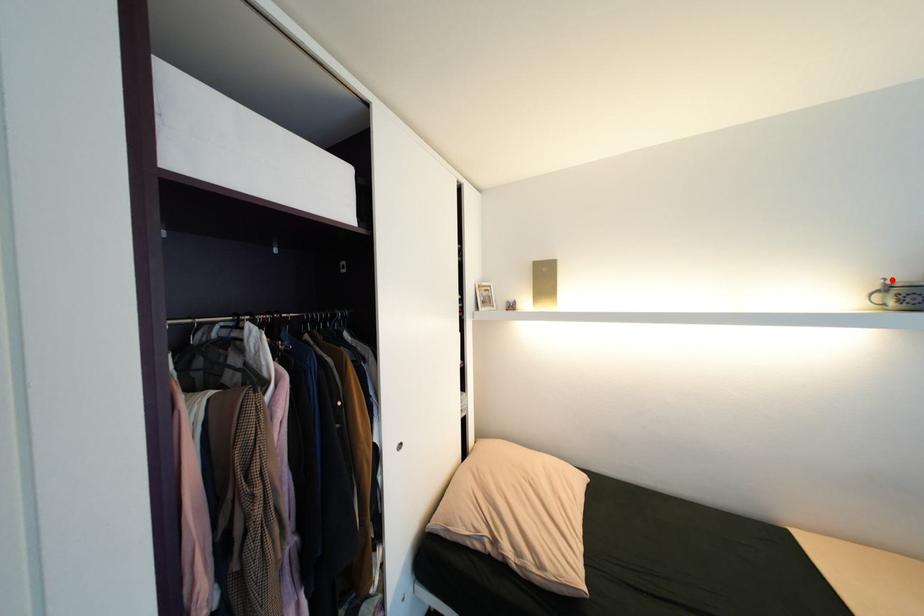
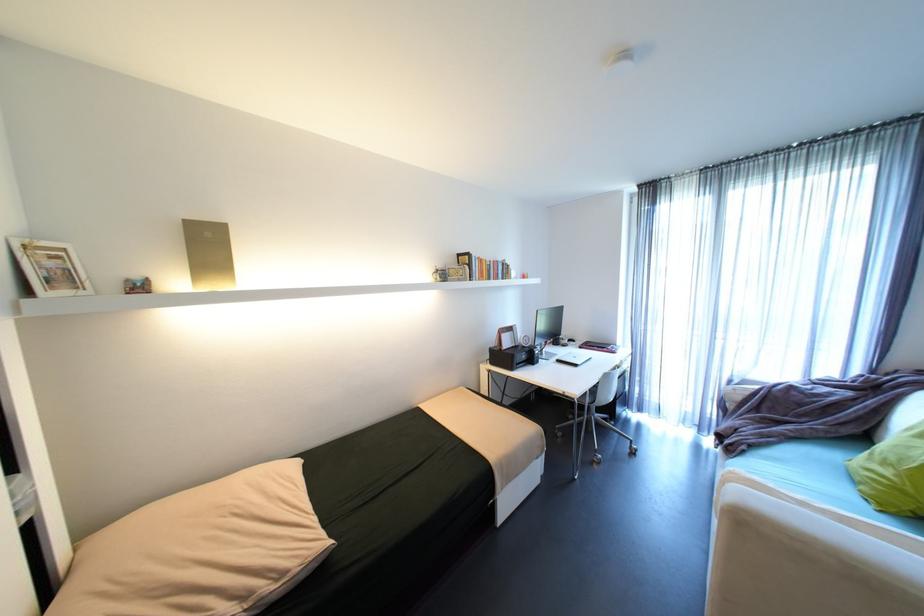
Locate, in the second image, the point that corresponds to the highlighted location in the first image.

(444, 267)